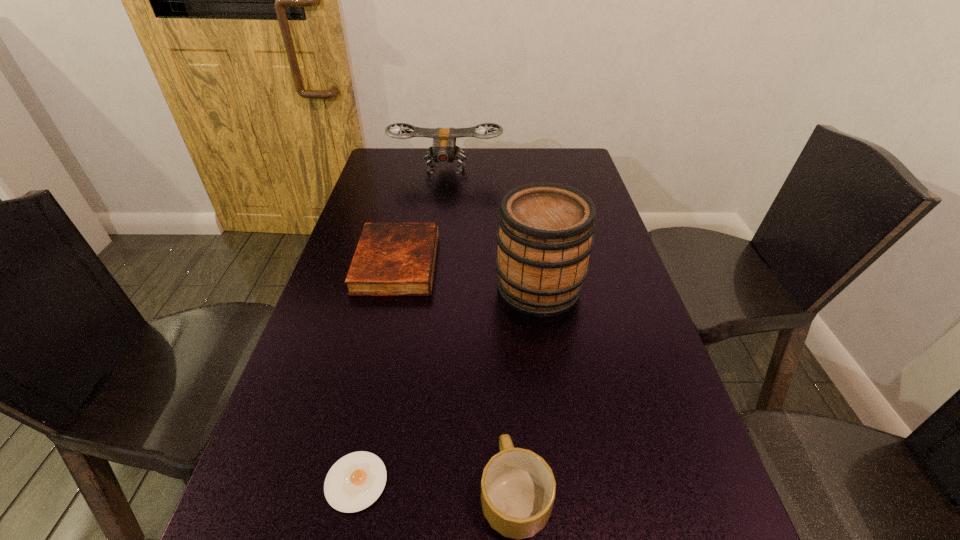
Find the location of a particular element. Image resolution: width=960 pixels, height=540 pixels. free point between the egg yolk and the cider is located at coordinates (447, 385).

At what (x,y) coordinates should I click in order to perform the action: click on free area in between the second shortest object and the cider. Please return your answer as a coordinate pair (x, y). Looking at the image, I should click on (468, 275).

In order to click on free space between the shortest object and the cider in this screenshot , I will do `click(447, 385)`.

This screenshot has width=960, height=540. I want to click on free spot between the second tallest object and the Bible, so click(x=421, y=216).

I want to click on empty space that is in between the farthest object and the shortest object, so click(401, 326).

At what (x,y) coordinates should I click in order to perform the action: click on free space that is in between the second shortest object and the cider. Please return your answer as a coordinate pair (x, y). Looking at the image, I should click on (468, 275).

The height and width of the screenshot is (540, 960). I want to click on empty location between the farthest object and the cider, so click(492, 229).

Locate an element on the screen. The width and height of the screenshot is (960, 540). the closest object to the third tallest object is located at coordinates (354, 482).

Point out which object is positioned as the third nearest to the tallest object. Please provide its 2D coordinates. Your answer should be formatted as a tuple, i.e. [(x, y)], where the tuple contains the x and y coordinates of a point satisfying the conditions above.

[(354, 482)]

In order to click on vacant region that satisfies the following two spatial constraints: 1. on the front-facing side of the cider; 2. on the right side of the farthest object in this screenshot , I will do `click(431, 288)`.